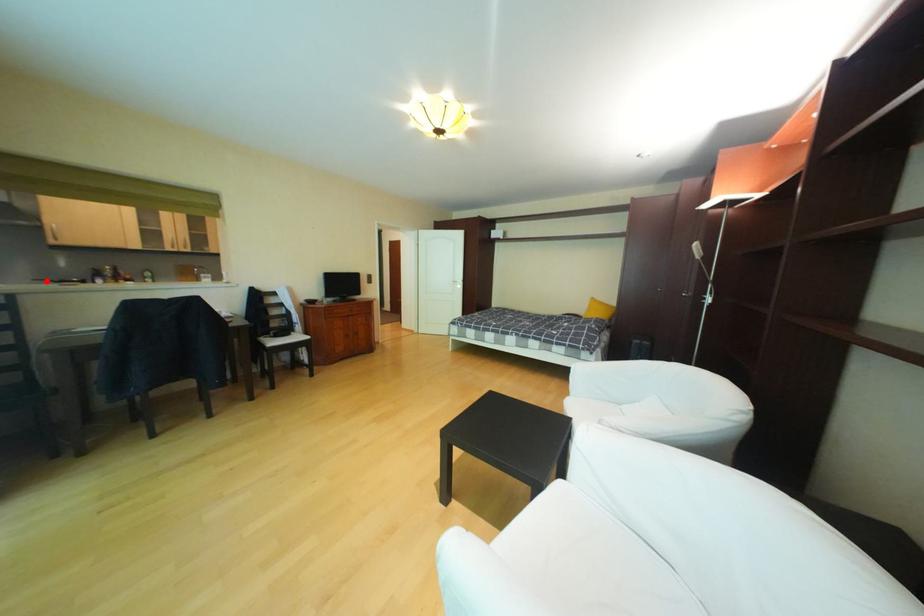
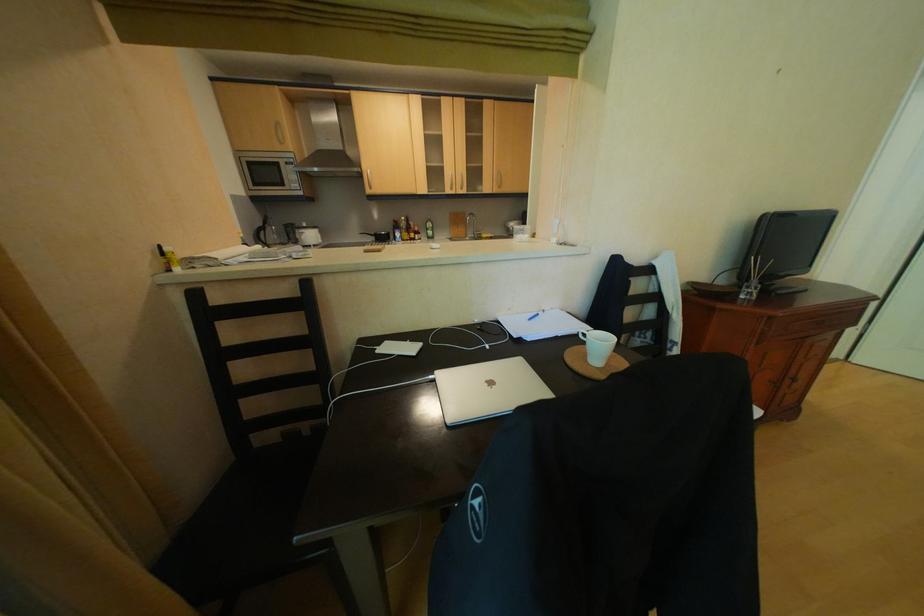
Find the pixel in the second image that matches the highlighted location in the first image.

(372, 235)